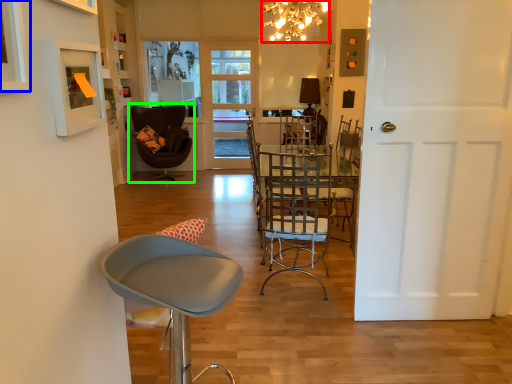
Question: Which is farther away from lamp (highlighted by a red box)? picture frame (highlighted by a blue box) or chair (highlighted by a green box)?

Choices:
 (A) picture frame
 (B) chair

Answer: (A)